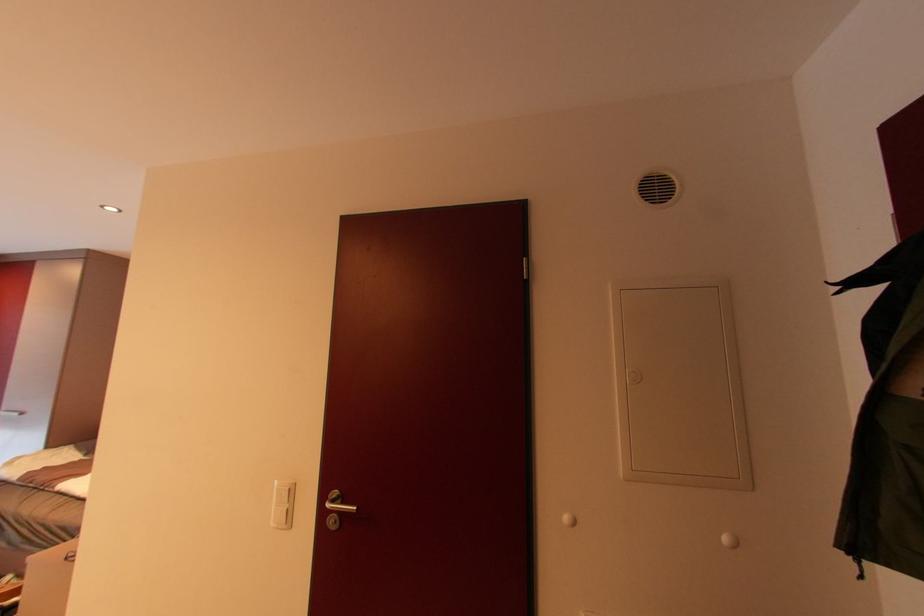
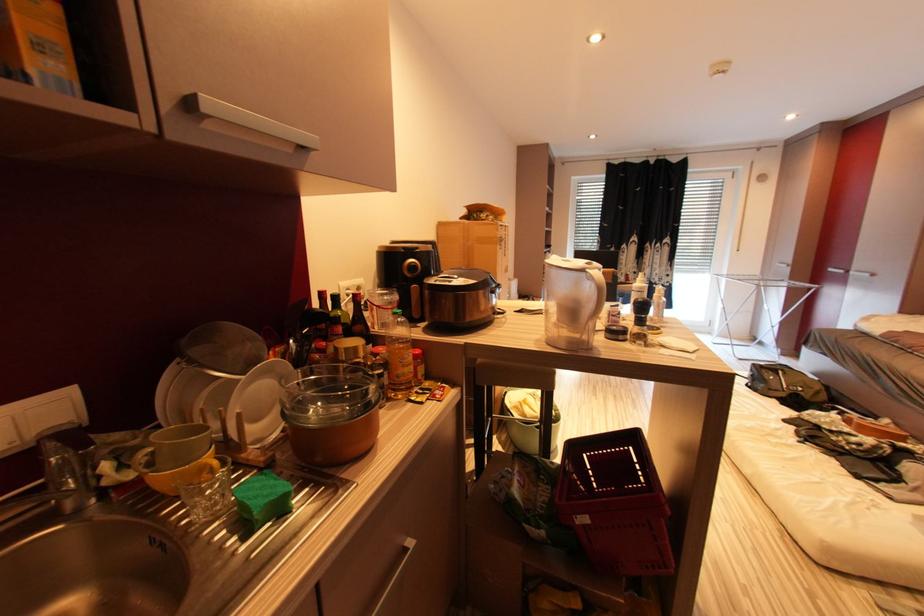
Question: The camera is either moving clockwise (left) or counter-clockwise (right) around the object. The first image is from the beginning of the video and the second image is from the end. Is the camera moving left or right when shooting the video?

Choices:
 (A) Left
 (B) Right

Answer: (B)